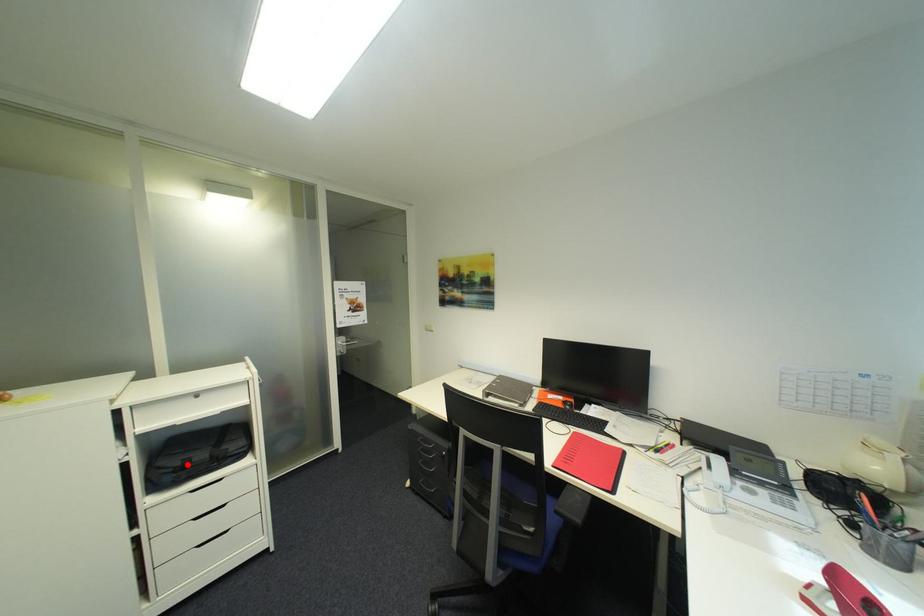
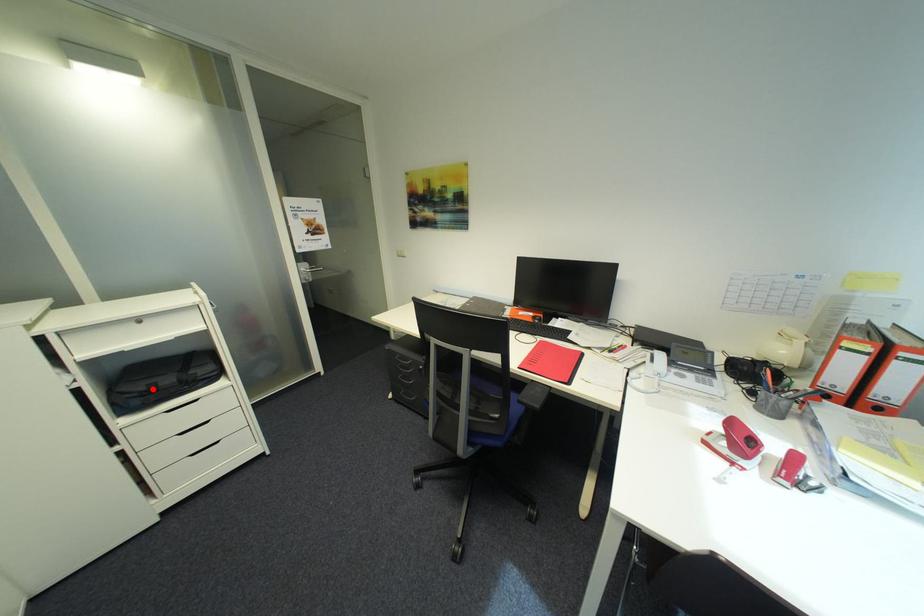
I am providing you with two images of the same scene from different viewpoints. A red point is marked on the first image and another point is marked on the second image. Is the red point in image1 aligned with the point shown in image2?

Yes